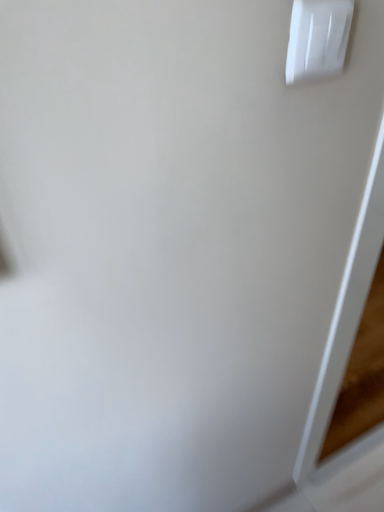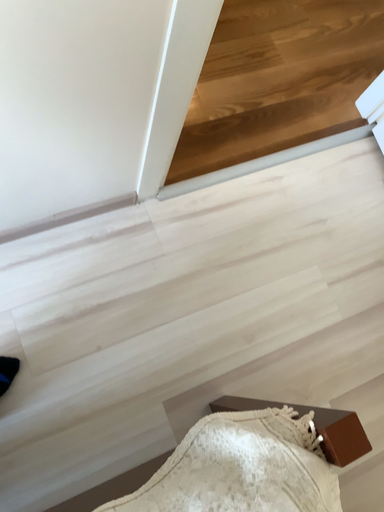
Question: Which way did the camera rotate in the video?

Choices:
 (A) rotated upward
 (B) rotated downward

Answer: (B)